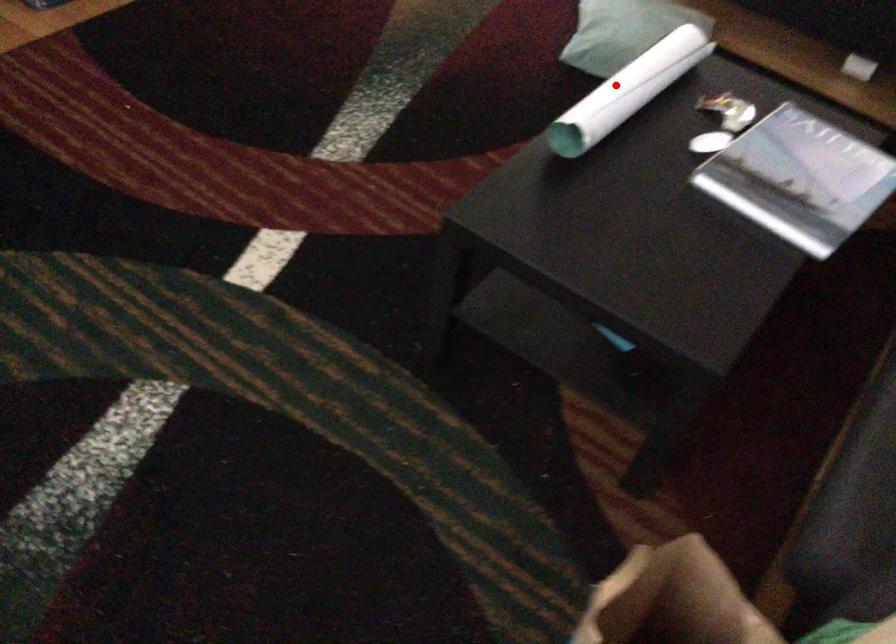
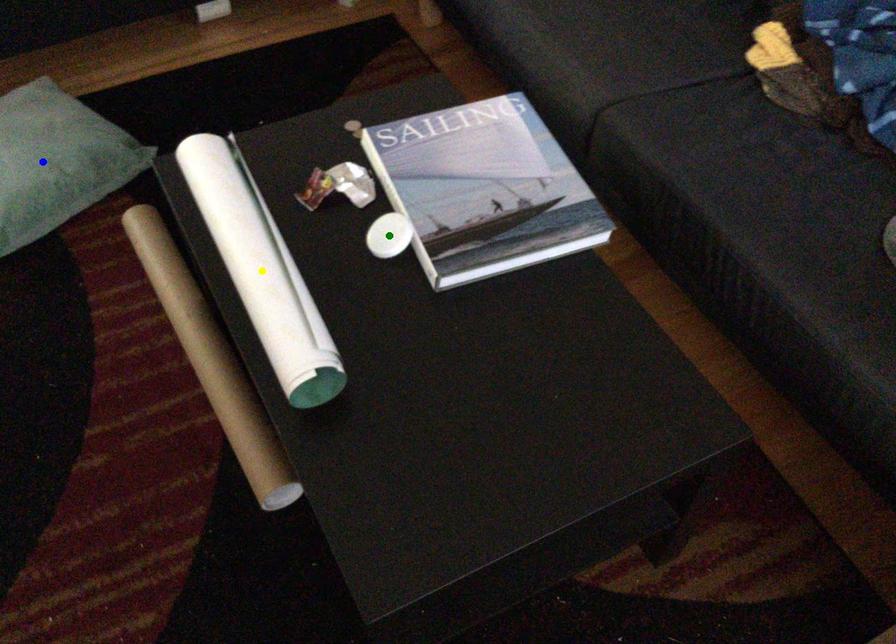
Question: I am providing you with two images of the same scene from different viewpoints. A red point is marked on the first image. You are given multiple points on the second image. Which spot in image 2 lines up with the point in image 1?

Choices:
 (A) green point
 (B) yellow point
 (C) blue point

Answer: (B)